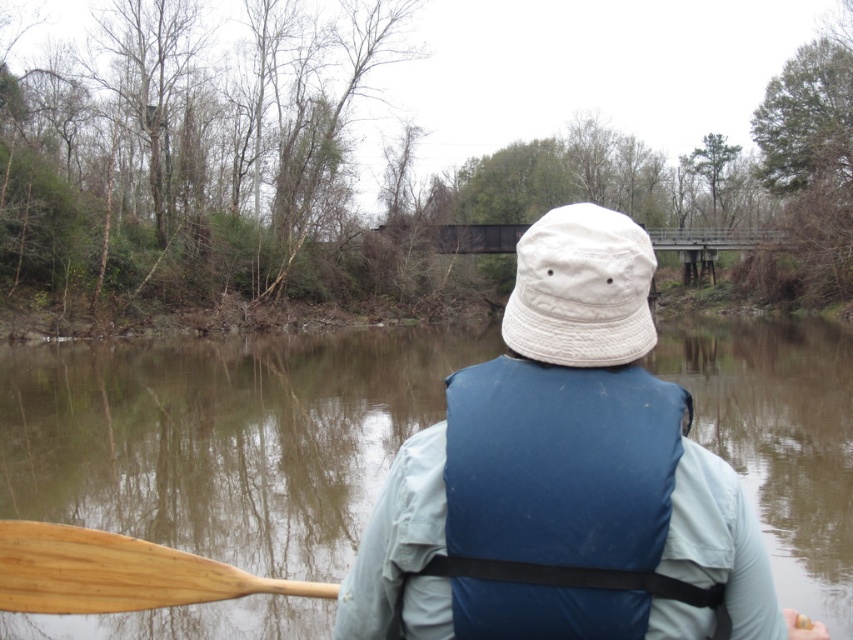
You are navigating a canoe on a river and need to locate the smooth water area to avoid rough patches. According to the image, where is the brown smooth water at center located in terms of coordinates?

The brown smooth water at center is located at coordinates point (224, 436).